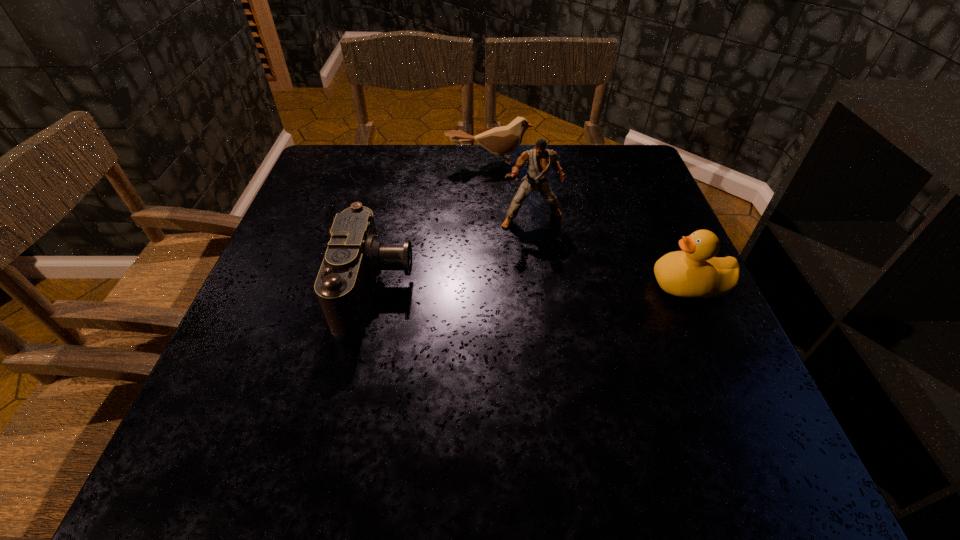
Locate an element on the screen. free spot between the duck and the puncher is located at coordinates (611, 252).

Find the location of `free area in between the second farthest object and the duck`. free area in between the second farthest object and the duck is located at coordinates (611, 252).

Where is `free space between the farthest object and the rightmost object`? Image resolution: width=960 pixels, height=540 pixels. free space between the farthest object and the rightmost object is located at coordinates (590, 224).

This screenshot has width=960, height=540. What are the coordinates of `free space between the camera and the puncher` in the screenshot? It's located at (454, 253).

This screenshot has width=960, height=540. What are the coordinates of `vacant space that is in between the third nearest object and the duck` in the screenshot? It's located at (611, 252).

I want to click on the third closest object to the camera, so click(x=694, y=272).

Find the location of `object that stands as the third closest to the leftmost object`. object that stands as the third closest to the leftmost object is located at coordinates (694, 272).

Find the location of a particular element. This screenshot has height=540, width=960. free region that satisfies the following two spatial constraints: 1. on the front side of the duck; 2. on the face of the puncher is located at coordinates (540, 285).